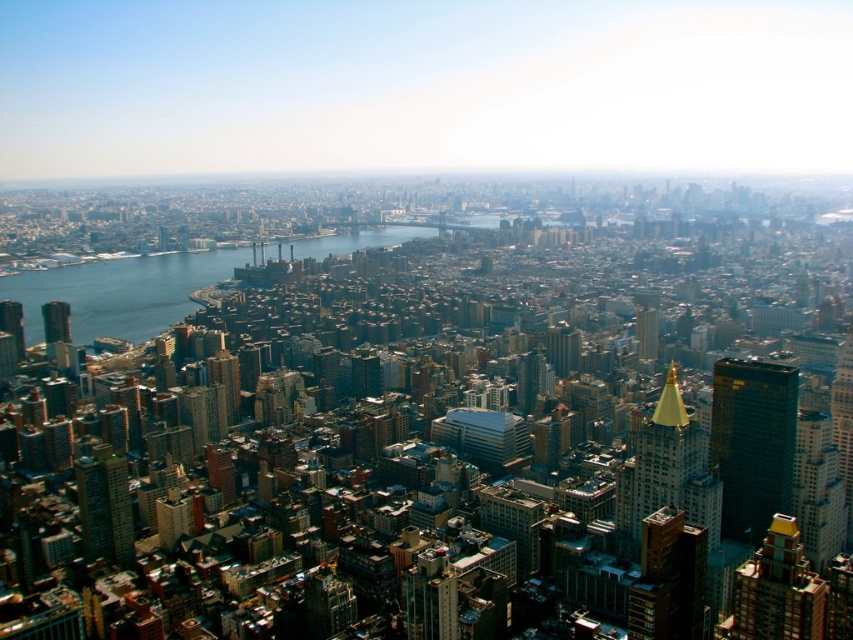
Question: Which point is farther to the camera?

Choices:
 (A) (54, 321)
 (B) (119, 497)
 (C) (688, 477)

Answer: (B)

Question: Can you confirm if blue water at center is positioned to the left of green glass skyscraper at center-left?

Choices:
 (A) no
 (B) yes

Answer: (A)

Question: Is the position of blue water at center more distant than that of gold metallic spire at center-right?

Choices:
 (A) yes
 (B) no

Answer: (B)

Question: Considering the real-world distances, which object is farthest from the gold metallic spire at center-right?

Choices:
 (A) matte black skyscraper at left
 (B) blue water at center

Answer: (A)

Question: Which of the following is the farthest from the observer?

Choices:
 (A) (105, 449)
 (B) (178, 304)

Answer: (A)

Question: Does blue water at center appear under gold metallic spire at center-right?

Choices:
 (A) no
 (B) yes

Answer: (A)